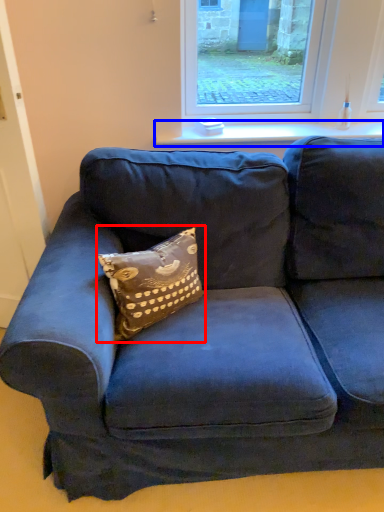
Question: Which of the following is the farthest to the observer, pillow (highlighted by a red box) or window sill (highlighted by a blue box)?

Choices:
 (A) pillow
 (B) window sill

Answer: (B)